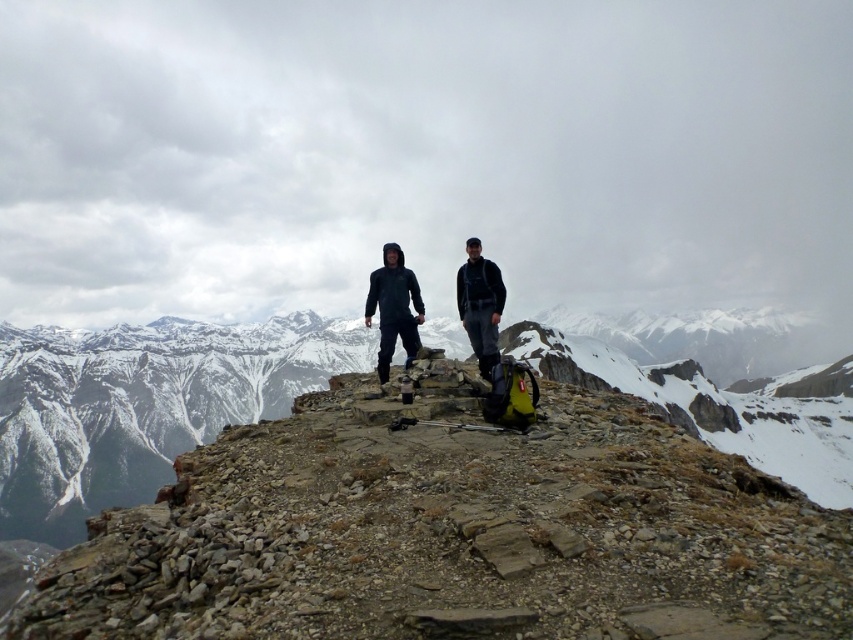
Question: Can you confirm if matte black jacket at center is positioned above dark gray hooded jacket at center?

Choices:
 (A) no
 (B) yes

Answer: (B)

Question: Is matte black jacket at center wider than dark gray hooded jacket at center?

Choices:
 (A) no
 (B) yes

Answer: (B)

Question: Which point is farther to the camera?

Choices:
 (A) rugged stone summit at center
 (B) dark gray hooded jacket at center

Answer: (B)

Question: Among these objects, which one is farthest from the camera?

Choices:
 (A) matte black jacket at center
 (B) dark gray hooded jacket at center
 (C) rugged stone summit at center

Answer: (A)

Question: Which of these objects is positioned closest to the dark gray hooded jacket at center?

Choices:
 (A) matte black jacket at center
 (B) rugged stone summit at center

Answer: (A)

Question: Can you confirm if matte black jacket at center is positioned above dark gray hooded jacket at center?

Choices:
 (A) yes
 (B) no

Answer: (A)